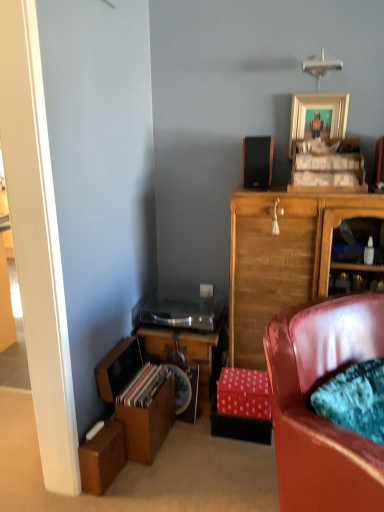
Question: Which direction should I rotate to look at gold metallic picture frame at upper center?

Choices:
 (A) left
 (B) right

Answer: (B)

Question: Can you confirm if wooden desk at lower left is thinner than pink polka dot cardboard box at lower center, which is the 1th cardboard box from back to front?

Choices:
 (A) no
 (B) yes

Answer: (A)

Question: Are wooden desk at lower left and pink polka dot cardboard box at lower center, which is the second cardboard box in bottom-to-top order, beside each other?

Choices:
 (A) no
 (B) yes

Answer: (A)

Question: From a real-world perspective, does wooden desk at lower left stand above pink polka dot cardboard box at lower center, the first cardboard box viewed from the right?

Choices:
 (A) yes
 (B) no

Answer: (A)

Question: Are wooden desk at lower left and pink polka dot cardboard box at lower center, which is the second cardboard box in bottom-to-top order, far apart?

Choices:
 (A) yes
 (B) no

Answer: (B)

Question: From the image's perspective, is wooden desk at lower left located beneath pink polka dot cardboard box at lower center, placed as the second cardboard box when sorted from front to back?

Choices:
 (A) yes
 (B) no

Answer: (B)

Question: Is pink polka dot cardboard box at lower center, the 1th cardboard box in the top-to-bottom sequence, at the back of wooden desk at lower left?

Choices:
 (A) yes
 (B) no

Answer: (B)

Question: Considering the relative sizes of brown cardboard box at lower left, which is the first cardboard box from bottom to top, and velvet teal cushion at lower right in the image provided, is brown cardboard box at lower left, which is the first cardboard box from bottom to top, thinner than velvet teal cushion at lower right?

Choices:
 (A) yes
 (B) no

Answer: (A)

Question: Is brown cardboard box at lower left, placed as the 1th cardboard box when sorted from front to back, at the left side of velvet teal cushion at lower right?

Choices:
 (A) no
 (B) yes

Answer: (B)

Question: From a real-world perspective, is brown cardboard box at lower left, acting as the second cardboard box starting from the right, positioned under velvet teal cushion at lower right based on gravity?

Choices:
 (A) no
 (B) yes

Answer: (B)

Question: From the image's perspective, is brown cardboard box at lower left, acting as the second cardboard box starting from the right, over velvet teal cushion at lower right?

Choices:
 (A) yes
 (B) no

Answer: (B)

Question: Is brown cardboard box at lower left, the second cardboard box viewed from the back, bigger than velvet teal cushion at lower right?

Choices:
 (A) yes
 (B) no

Answer: (B)

Question: Is brown cardboard box at lower left, acting as the second cardboard box starting from the right, to the right of velvet teal cushion at lower right from the viewer's perspective?

Choices:
 (A) yes
 (B) no

Answer: (B)

Question: From a real-world perspective, is gold metallic picture frame at upper center on pink polka dot cardboard box at lower center, which is the second cardboard box in bottom-to-top order?

Choices:
 (A) yes
 (B) no

Answer: (A)